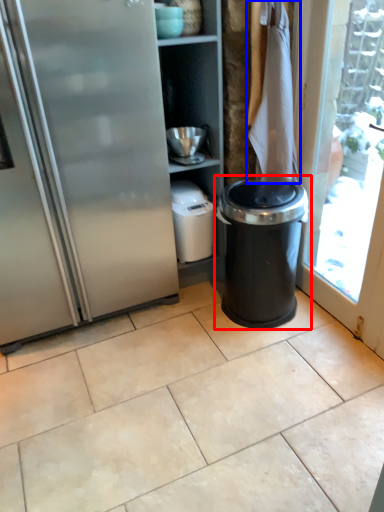
Question: Among these objects, which one is nearest to the camera, waste container (highlighted by a red box) or laundry (highlighted by a blue box)?

Choices:
 (A) waste container
 (B) laundry

Answer: (A)